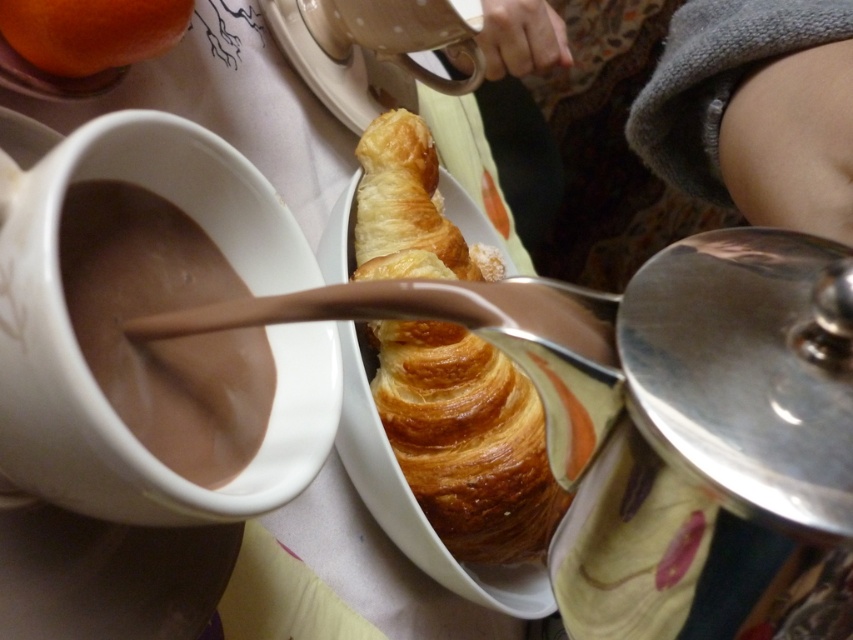
What are the coordinates of the golden brown flaky croissant at center?

The golden brown flaky croissant at center is located at coordinates point (x=466, y=440).

You are planning to place a small vase between the golden brown flaky croissant at center and the orange matte at upper left. Given that the vase is 5 inches wide, will it fit without overlapping either object?

The golden brown flaky croissant at center is 10.20 inches from the orange matte at upper left. Since the vase is only 5 inches wide, it will fit between them without overlapping either object as there is enough space.